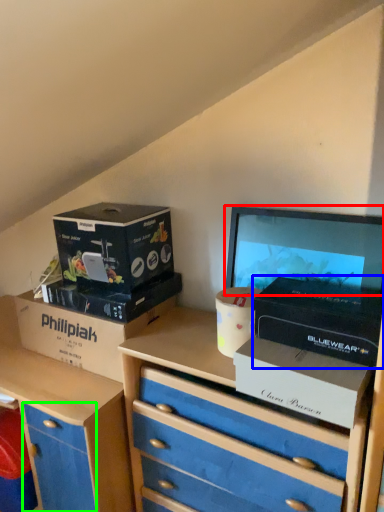
Question: Which object is the farthest from computer monitor (highlighted by a red box)? Choose among these: box (highlighted by a blue box) or drawer (highlighted by a green box).

Choices:
 (A) box
 (B) drawer

Answer: (B)